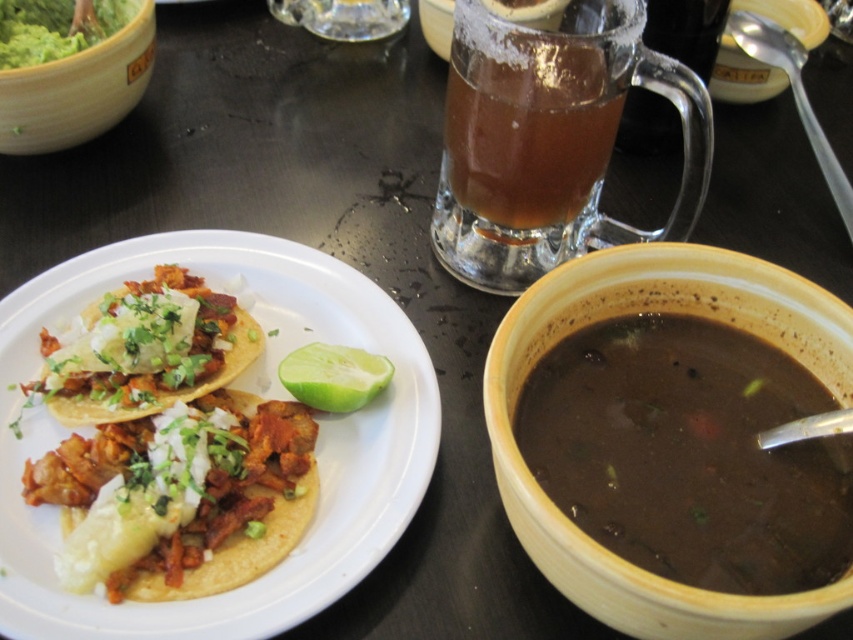
Is white tortilla at center further to the viewer compared to translucent glass mug at upper center?

No, it is in front of translucent glass mug at upper center.

Is white tortilla at center bigger than translucent glass mug at upper center?

Yes, white tortilla at center is bigger than translucent glass mug at upper center.

The width and height of the screenshot is (853, 640). What do you see at coordinates (238, 388) in the screenshot?
I see `white tortilla at center` at bounding box center [238, 388].

Where is `white tortilla at center`? The width and height of the screenshot is (853, 640). white tortilla at center is located at coordinates (238, 388).

Can you confirm if white tortilla at center is positioned to the left of shiny silver taco at left?

Yes, white tortilla at center is to the left of shiny silver taco at left.

Between white tortilla at center and shiny silver taco at left, which one appears on the left side from the viewer's perspective?

Positioned to the left is white tortilla at center.

Is point (9, 497) positioned behind point (91, 493)?

Yes, point (9, 497) is farther from viewer.

Identify the location of white tortilla at center. (238, 388).

Who is more distant from viewer, (x=41, y=49) or (x=349, y=378)?

Point (x=41, y=49)

Does green smooth guacamole at upper left have a greater width compared to green matte lime at center?

Yes.

Locate an element on the screen. The height and width of the screenshot is (640, 853). green smooth guacamole at upper left is located at coordinates (54, 28).